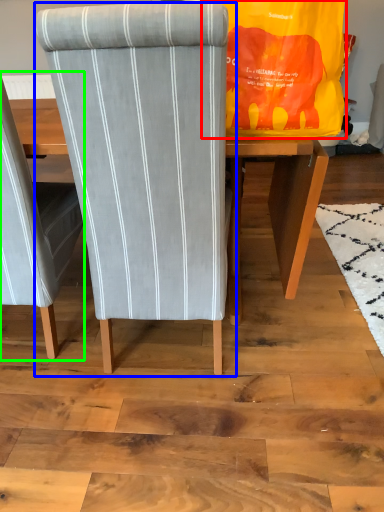
Question: Which object is positioned closest to bag (highlighted by a red box)? Select from chair (highlighted by a blue box) and chair (highlighted by a green box).

Choices:
 (A) chair
 (B) chair

Answer: (A)